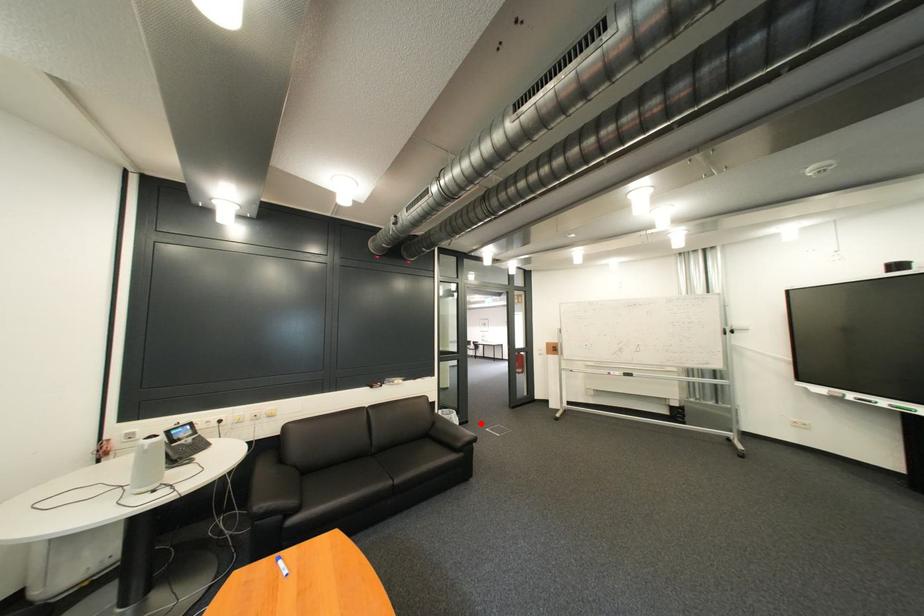
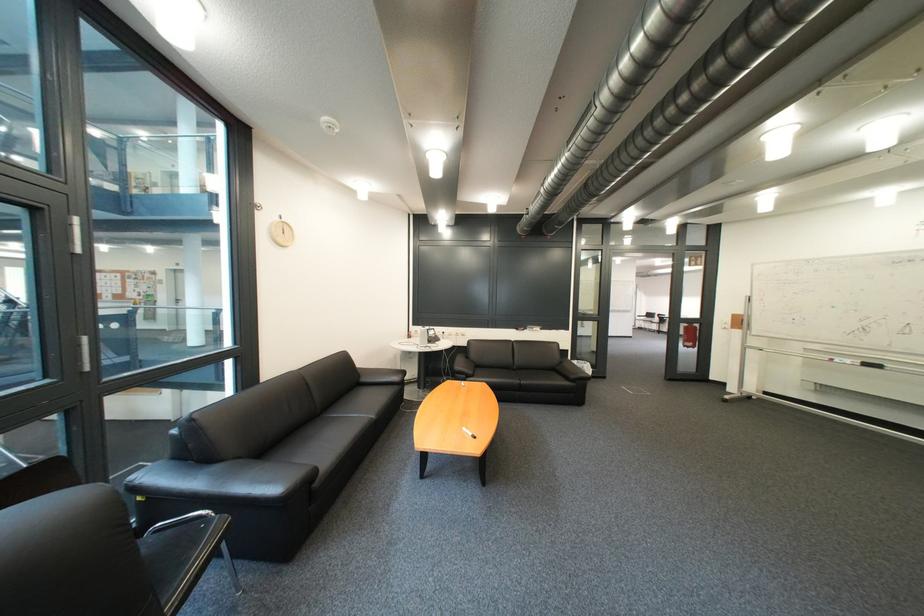
Question: I am providing you with two images of the same scene from different viewpoints. A red point is shown in image1. For the corresponding object point in image2, is it positioned nearer or farther from the camera?

Choices:
 (A) Nearer
 (B) Farther

Answer: (A)